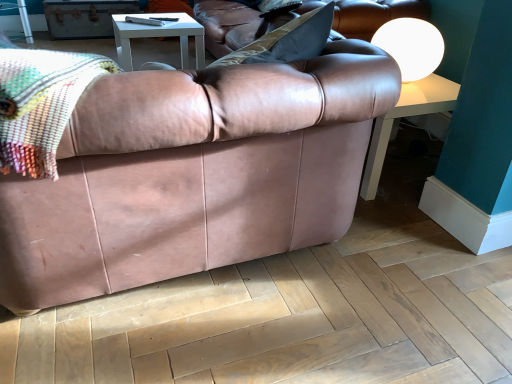
Question: Is matte brown leather couch at center looking in the opposite direction of white matte sphere at upper right?

Choices:
 (A) no
 (B) yes

Answer: (A)

Question: Is white matte sphere at upper right a part of matte brown leather couch at center?

Choices:
 (A) no
 (B) yes

Answer: (A)

Question: Does matte brown leather couch at center have a larger size compared to white matte sphere at upper right?

Choices:
 (A) no
 (B) yes

Answer: (B)

Question: Is matte brown leather couch at center closer to camera compared to white matte sphere at upper right?

Choices:
 (A) no
 (B) yes

Answer: (B)

Question: From a real-world perspective, is matte brown leather couch at center on white matte sphere at upper right?

Choices:
 (A) yes
 (B) no

Answer: (B)

Question: Is matte brown leather couch at center aimed at white matte sphere at upper right?

Choices:
 (A) yes
 (B) no

Answer: (B)

Question: Is matte brown leather couch at center closer to the viewer compared to multicolored woven blanket at upper left?

Choices:
 (A) yes
 (B) no

Answer: (A)

Question: Does matte brown leather couch at center have a greater width compared to multicolored woven blanket at upper left?

Choices:
 (A) yes
 (B) no

Answer: (A)

Question: Is matte brown leather couch at center bigger than multicolored woven blanket at upper left?

Choices:
 (A) yes
 (B) no

Answer: (A)

Question: Is matte brown leather couch at center oriented away from multicolored woven blanket at upper left?

Choices:
 (A) yes
 (B) no

Answer: (B)

Question: Is multicolored woven blanket at upper left surrounded by matte brown leather couch at center?

Choices:
 (A) no
 (B) yes

Answer: (B)

Question: Does matte brown leather couch at center have a lesser height compared to multicolored woven blanket at upper left?

Choices:
 (A) no
 (B) yes

Answer: (A)

Question: Considering the relative positions of white matte sphere at upper right and light brown wood at lower center in the image provided, is white matte sphere at upper right to the right of light brown wood at lower center from the viewer's perspective?

Choices:
 (A) yes
 (B) no

Answer: (A)